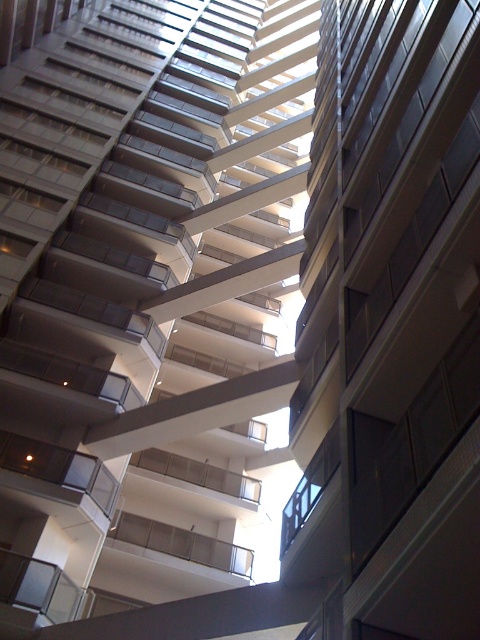
Is glassy transparent balcony at center to the left of white glass balcony at center from the viewer's perspective?

Indeed, glassy transparent balcony at center is positioned on the left side of white glass balcony at center.

Can you confirm if glassy transparent balcony at center is wider than white glass balcony at center?

No.

At what (x,y) coordinates should I click in order to perform the action: click on glassy transparent balcony at center. Please return your answer as a coordinate pair (x, y). The width and height of the screenshot is (480, 640). Looking at the image, I should click on (69, 372).

Identify the location of glassy transparent balcony at center. (69, 372).

Can you confirm if clear glass balcony at lower left is thinner than glassy transparent balcony at center?

Yes.

Which is in front, point (112, 481) or point (25, 356)?

Positioned in front is point (112, 481).

This screenshot has width=480, height=640. Describe the element at coordinates (60, 468) in the screenshot. I see `clear glass balcony at lower left` at that location.

Locate an element on the screen. Image resolution: width=480 pixels, height=640 pixels. clear glass balcony at lower left is located at coordinates (60, 468).

Is clear glass balcony at lower left above metallic silver balcony at center?

Correct, clear glass balcony at lower left is located above metallic silver balcony at center.

Does clear glass balcony at lower left have a greater width compared to metallic silver balcony at center?

Incorrect, clear glass balcony at lower left's width does not surpass metallic silver balcony at center's.

Is point (25, 461) closer to viewer compared to point (250, 572)?

Yes, point (25, 461) is in front of point (250, 572).

I want to click on clear glass balcony at lower left, so (60, 468).